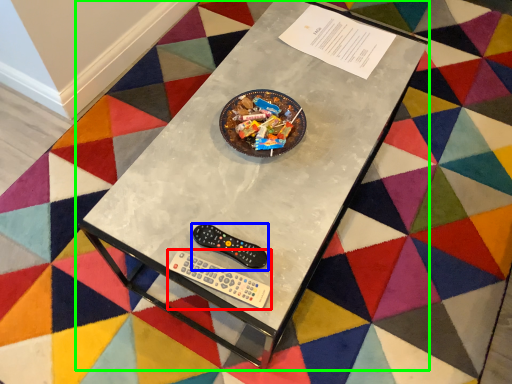
Question: Which is nearer to the Wii controller (highlighted by a red box)? control (highlighted by a blue box) or table (highlighted by a green box).

Choices:
 (A) control
 (B) table

Answer: (A)